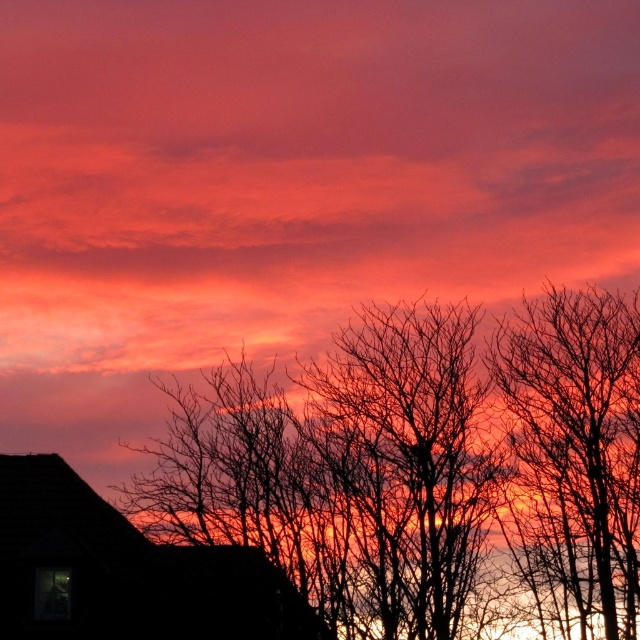
Question: Does silhouette bare tree at center come in front of bare branches at right?

Choices:
 (A) no
 (B) yes

Answer: (B)

Question: Which of the following is the closest to the observer?

Choices:
 (A) (410, 336)
 (B) (628, 561)

Answer: (B)

Question: Is silhouette bare tree at center below bare branches at right?

Choices:
 (A) yes
 (B) no

Answer: (A)

Question: Does silhouette bare tree at center have a smaller size compared to bare branches at right?

Choices:
 (A) yes
 (B) no

Answer: (B)

Question: Which object is farther from the camera taking this photo?

Choices:
 (A) silhouette bare tree at center
 (B) bare branches at right

Answer: (B)